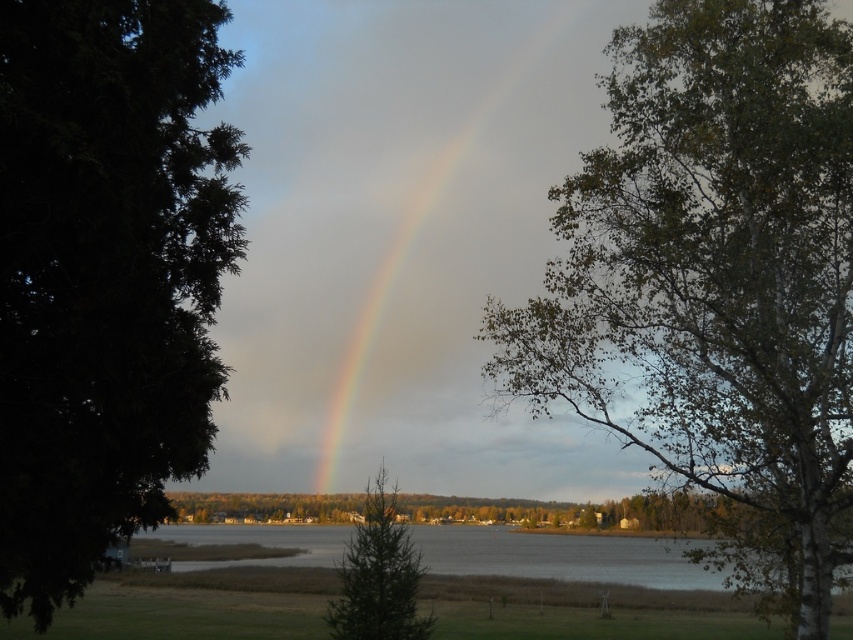
Question: Is green textured tree at left closer to the viewer compared to green matte tree at center?

Choices:
 (A) yes
 (B) no

Answer: (A)

Question: Which object is the closest to the green matte tree at center?

Choices:
 (A) green textured tree at left
 (B) rainbow at center
 (C) green leafy tree at right

Answer: (B)

Question: Is green leafy tree at right positioned in front of green textured tree at left?

Choices:
 (A) yes
 (B) no

Answer: (B)

Question: Does green leafy tree at right appear on the right side of green matte tree at center?

Choices:
 (A) yes
 (B) no

Answer: (A)

Question: Among these objects, which one is farthest from the camera?

Choices:
 (A) clear water at lower center
 (B) green matte tree at center
 (C) green leafy tree at right
 (D) green textured tree at left

Answer: (A)

Question: Which point is farther from the camera taking this photo?

Choices:
 (A) (798, 310)
 (B) (115, 198)
 (C) (656, 541)
 (D) (361, 564)

Answer: (C)